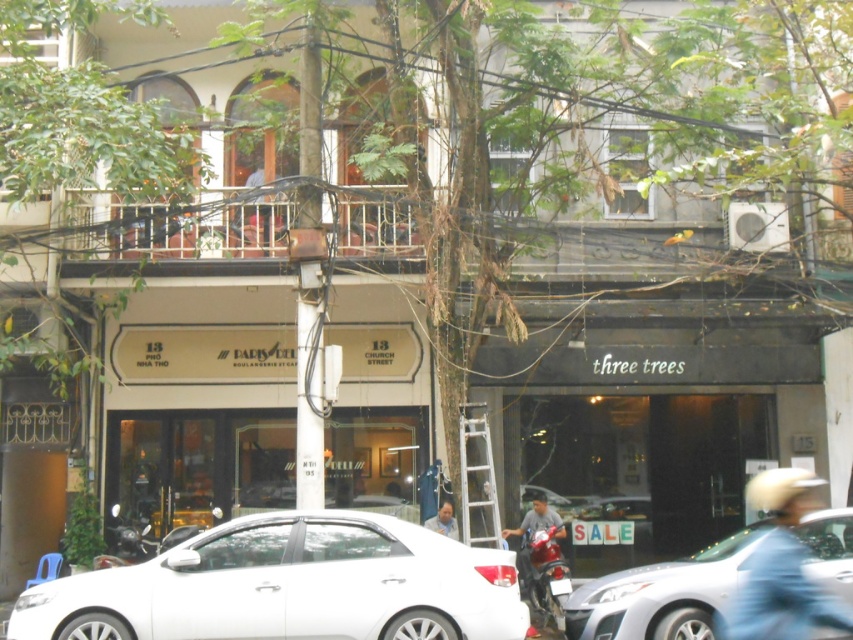
Question: Does blue helmet at upper right have a greater width compared to light blue shirt at center?

Choices:
 (A) no
 (B) yes

Answer: (A)

Question: Which object is positioned farthest from the light blue shirt at center?

Choices:
 (A) white glossy car at lower center
 (B) white glossy sedan at center
 (C) white plastic ladder at center
 (D) blue helmet at upper right

Answer: (D)

Question: Which object is closer to the camera taking this photo?

Choices:
 (A) light blue shirt at center
 (B) white plastic ladder at center
 (C) shiny red motorcycle at lower right

Answer: (C)

Question: Does shiny red motorcycle at lower right lie behind light blue shirt at center?

Choices:
 (A) no
 (B) yes

Answer: (A)

Question: Estimate the real-world distances between objects in this image. Which object is closer to the white glossy car at lower center?

Choices:
 (A) blue helmet at upper right
 (B) white glossy sedan at center
 (C) light blue shirt at center

Answer: (A)

Question: Is shiny red motorcycle at lower right positioned behind light blue shirt at center?

Choices:
 (A) yes
 (B) no

Answer: (B)